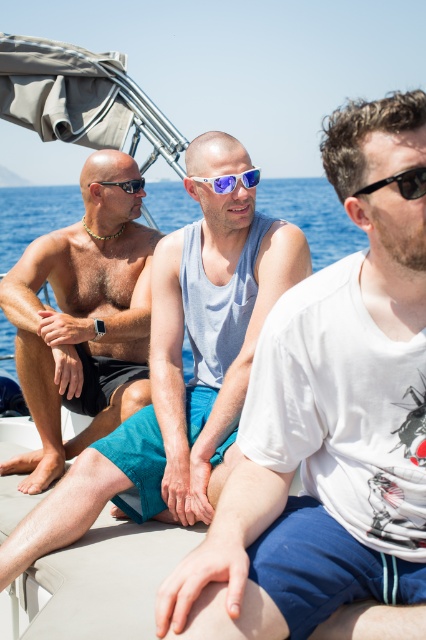
Based on the scene, which object is positioned lower in the image between the bare chested torso at center and the blue water at center?

The bare chested torso at center is positioned below the blue water at center in the image.

You are a photographer standing on the deck of the boat. You want to take a photo that includes both the bare chested torso at center and the matte black sunglasses at left. The camera you have can only focus on objects within a 5 meter range. Will both subjects be in focus?

The bare chested torso at center is 4.94 meters from matte black sunglasses at left. Since the distance between them is within the 5 meter range, both subjects will be in focus.